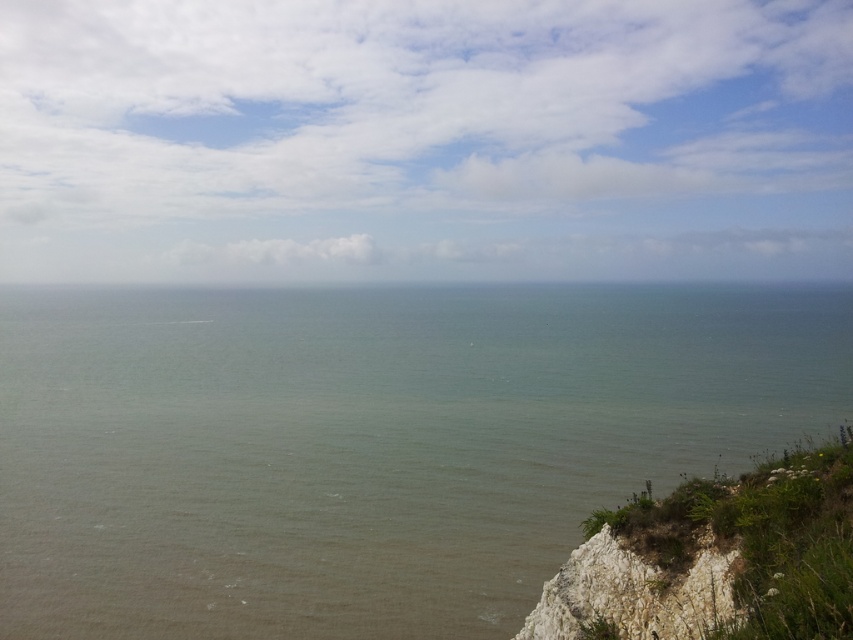
Does point (660, 344) lie in front of point (837, 566)?

That is False.

Does point (314, 301) come behind point (683, 513)?

Yes, point (314, 301) is behind point (683, 513).

I want to click on greenish-gray water at center, so 369,444.